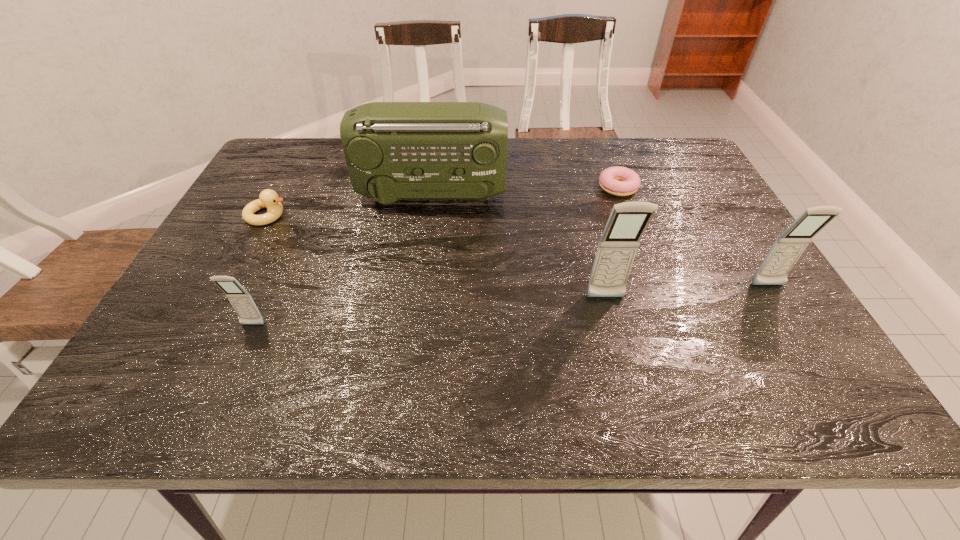
Identify the location of object that stands as the fifth closest to the fifth tallest object. Image resolution: width=960 pixels, height=540 pixels. (789, 246).

Select which object appears as the second closest to the fifth farthest object. Please provide its 2D coordinates. Your answer should be formatted as a tuple, i.e. [(x, y)], where the tuple contains the x and y coordinates of a point satisfying the conditions above.

[(394, 151)]

Where is `cellular telephone that can be found as the closest to the leftmost cellular telephone`? The width and height of the screenshot is (960, 540). cellular telephone that can be found as the closest to the leftmost cellular telephone is located at coordinates (617, 248).

The height and width of the screenshot is (540, 960). I want to click on cellular telephone that is the second closest one to the fifth object from right to left, so click(789, 246).